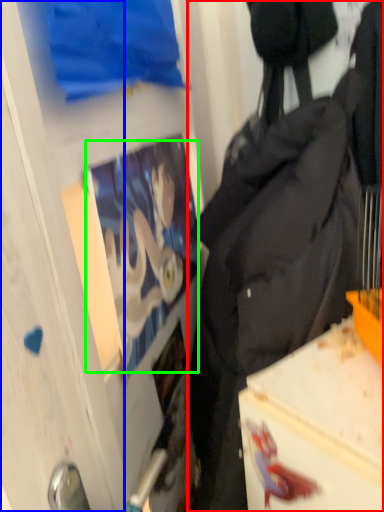
Question: Considering the real-world distances, which object is closest to backpack (highlighted by a red box)? glass door (highlighted by a blue box) or person (highlighted by a green box).

Choices:
 (A) glass door
 (B) person

Answer: (B)